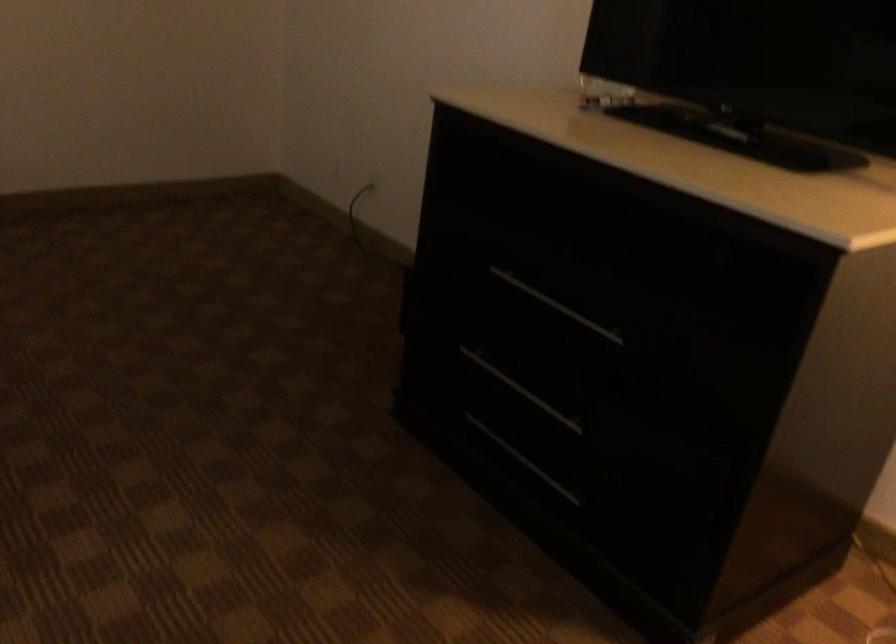
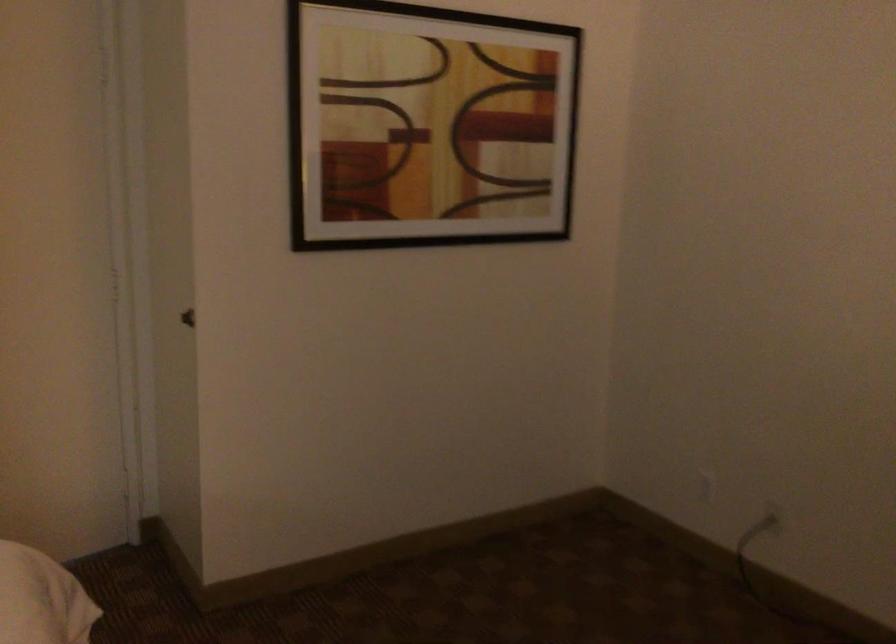
What movement of the cameraman would produce the second image?

The cameraman moved toward left, forward.